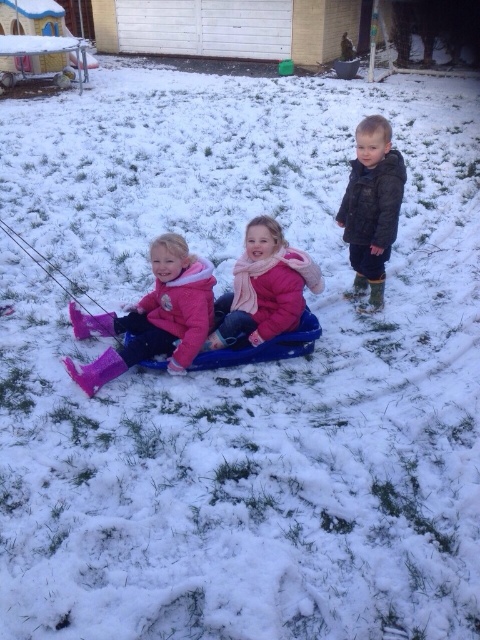
Where is the pink fleece jacket at center located in the image?

The pink fleece jacket at center is located at point coordinates of 0.452 on the x axis and 0.550 on the y axis.

You are a parent trying to choose between two winter outfits for your child from the image. The options are the matte pink snowsuit at left and the pink fleece jacket at center. Based on their sizes, which one would you recommend if you want a larger outfit?

The matte pink snowsuit at left is larger than the pink fleece jacket at center, so it would be the better choice if you want a larger outfit.

You are standing at the bottom of the slope and want to place a flag exactly halfway between the two points marked as point (156,292) and point (284,307). Which direction should you walk from the bottom of the slope to reach the halfway point?

The halfway point between point (156,292) and point (284,307) is closer to the camera than point (284,307) but further than point (156,292). Since you are at the bottom of the slope, you should walk upwards towards the slope to reach the halfway point.